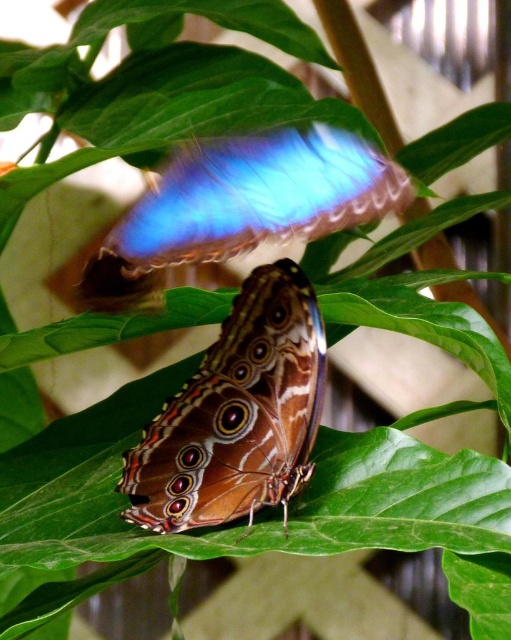
You are a researcher studying butterfly positioning in a natural habitat. You observe two butterflies in an image. One is a brown textured butterfly at center, and the other is a vibrant blue butterfly in the background. Based on their coordinates, which butterfly is closer to the center of the image?

Result: The brown textured butterfly at center is closer to the center of the image because its coordinates are at point (x=237, y=413), which is near the center compared to the vibrant blue butterfly in the background.

You are standing 3 feet away from a brown textured butterfly at center. You want to take a photo of it without disturbing it. If the camera you are using has a minimum focusing distance of 3 feet, will you be able to take a clear photo?

The brown textured butterfly at center is 3.47 feet away from you. Since your camera can focus as close as 3 feet, you are within the required distance to take a clear photo.

Looking at this image, you are a nature photographer aiming to capture both butterflies in a single shot. Given that the brown textured butterfly at center is exactly at point (x=237, y=413), can you confirm if the vibrant blue butterfly in the background is positioned to the left or right of this central point?

The brown textured butterfly at center is located at point (x=237, y=413). Since the vibrant blue butterfly in the background is positioned in the background, it is likely to the right of the central point.